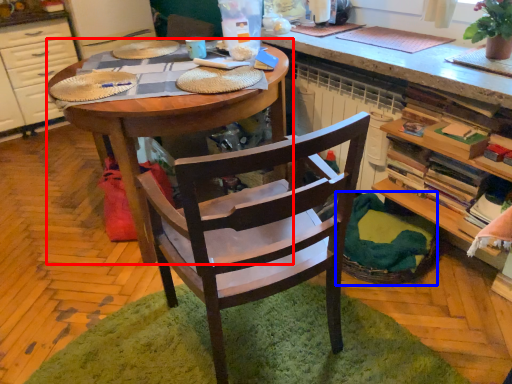
Question: Which object appears closest to the camera in this image, desk (highlighted by a red box) or basket (highlighted by a blue box)?

Choices:
 (A) desk
 (B) basket

Answer: (A)